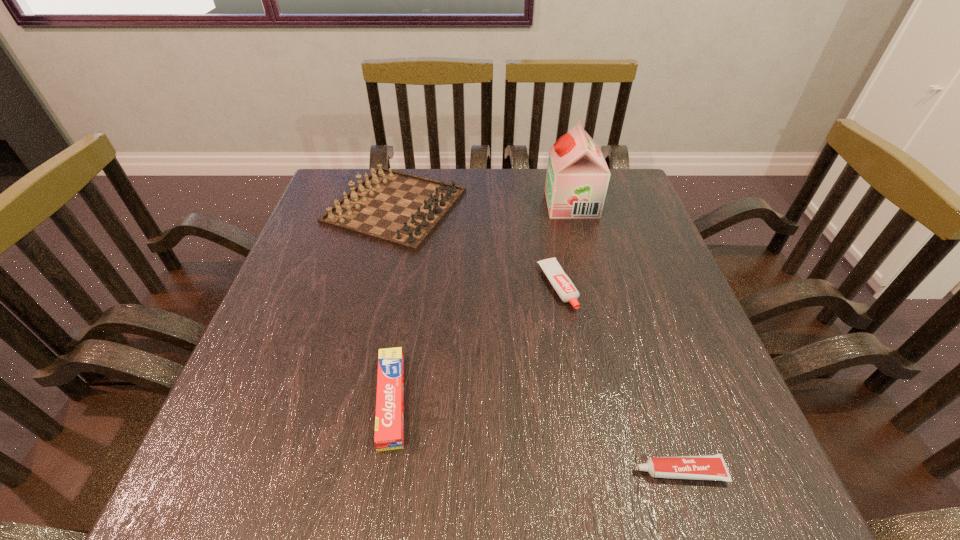
In order to click on vacant space located with the cap open on the soya milk in this screenshot , I will do 474,204.

At what (x,y) coordinates should I click in order to perform the action: click on free point located on the front of the second tallest object. Please return your answer as a coordinate pair (x, y). This screenshot has height=540, width=960. Looking at the image, I should click on (363, 346).

Find the location of a particular element. free space located 0.380m on the left of the farthest toothpaste is located at coordinates (368, 286).

This screenshot has width=960, height=540. Identify the location of free space located 0.240m on the right of the second nearest object. (546, 401).

Locate an element on the screen. vacant region located 0.320m at the nozzle of the shortest object is located at coordinates (429, 471).

Locate an element on the screen. This screenshot has height=540, width=960. blank area located 0.240m at the nozzle of the shortest object is located at coordinates (481, 471).

This screenshot has width=960, height=540. What are the coordinates of `free region located 0.360m at the nozzle of the shortest object` in the screenshot? It's located at (404, 471).

Locate an element on the screen. The width and height of the screenshot is (960, 540). soya milk at the far edge is located at coordinates [577, 178].

This screenshot has width=960, height=540. What are the coordinates of `chessboard located at the far edge` in the screenshot? It's located at (390, 206).

This screenshot has width=960, height=540. In order to click on object positioned at the left edge in this screenshot , I will do `click(390, 206)`.